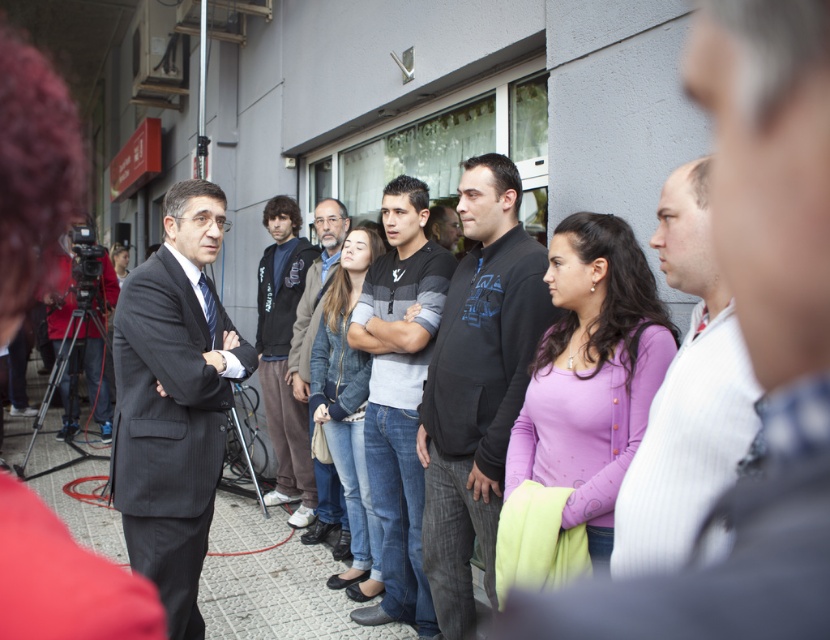
Question: Considering the relative positions of dark gray pinstripe suit at center and dark gray sweater at center in the image provided, where is dark gray pinstripe suit at center located with respect to dark gray sweater at center?

Choices:
 (A) left
 (B) right

Answer: (A)

Question: Which point is closer to the camera?

Choices:
 (A) black shirt at center
 (B) gray knit sweater at center
 (C) gray striped sweater at center

Answer: (A)

Question: Based on their relative distances, which object is farther from the gray striped sweater at center?

Choices:
 (A) dark gray sweater at center
 (B) black shirt at center

Answer: (B)

Question: Does striped shirt at center appear on the right side of gray knit sweater at center?

Choices:
 (A) yes
 (B) no

Answer: (A)

Question: Can you confirm if dark gray pinstripe suit at center is smaller than gray striped sweater at center?

Choices:
 (A) yes
 (B) no

Answer: (A)

Question: Which object appears closest to the camera in this image?

Choices:
 (A) black shirt at center
 (B) gray knit sweater at center
 (C) dark gray sweater at center
 (D) gray striped sweater at center

Answer: (A)